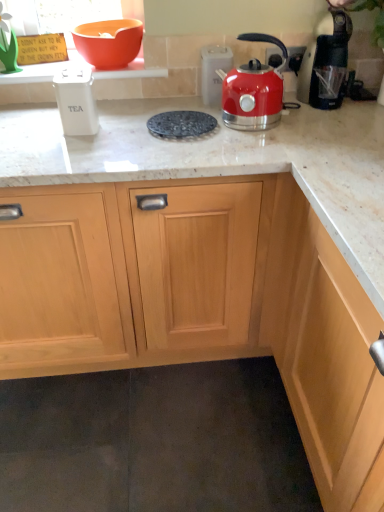
Question: From a real-world perspective, is orange matte bowl at upper left located beneath white marble countertop at center?

Choices:
 (A) yes
 (B) no

Answer: (B)

Question: Considering the relative sizes of orange matte bowl at upper left and white marble countertop at center in the image provided, is orange matte bowl at upper left thinner than white marble countertop at center?

Choices:
 (A) yes
 (B) no

Answer: (A)

Question: Is orange matte bowl at upper left behind white marble countertop at center?

Choices:
 (A) yes
 (B) no

Answer: (A)

Question: From a real-world perspective, is orange matte bowl at upper left positioned over white marble countertop at center based on gravity?

Choices:
 (A) no
 (B) yes

Answer: (B)

Question: Is orange matte bowl at upper left at the left side of white marble countertop at center?

Choices:
 (A) yes
 (B) no

Answer: (A)

Question: Does orange matte bowl at upper left appear on the right side of white marble countertop at center?

Choices:
 (A) no
 (B) yes

Answer: (A)

Question: Considering the relative sizes of shiny metallic kettle at upper right, the third kitchen appliance viewed from the left, and black textured trivet at center in the image provided, is shiny metallic kettle at upper right, the third kitchen appliance viewed from the left, bigger than black textured trivet at center?

Choices:
 (A) no
 (B) yes

Answer: (B)

Question: Does shiny metallic kettle at upper right, the third kitchen appliance viewed from the left, turn towards black textured trivet at center?

Choices:
 (A) no
 (B) yes

Answer: (A)

Question: Is shiny metallic kettle at upper right, the third kitchen appliance viewed from the left, smaller than black textured trivet at center?

Choices:
 (A) no
 (B) yes

Answer: (A)

Question: From a real-world perspective, is shiny metallic kettle at upper right, the third kitchen appliance viewed from the left, over black textured trivet at center?

Choices:
 (A) no
 (B) yes

Answer: (B)

Question: Is shiny metallic kettle at upper right, the third kitchen appliance viewed from the left, wider than black textured trivet at center?

Choices:
 (A) yes
 (B) no

Answer: (B)

Question: Is shiny metallic kettle at upper right, the second kitchen appliance from the right, thinner than black textured trivet at center?

Choices:
 (A) yes
 (B) no

Answer: (A)

Question: Considering the relative sizes of metallic silver outlet at upper right and orange matte bowl at upper left in the image provided, is metallic silver outlet at upper right thinner than orange matte bowl at upper left?

Choices:
 (A) yes
 (B) no

Answer: (A)